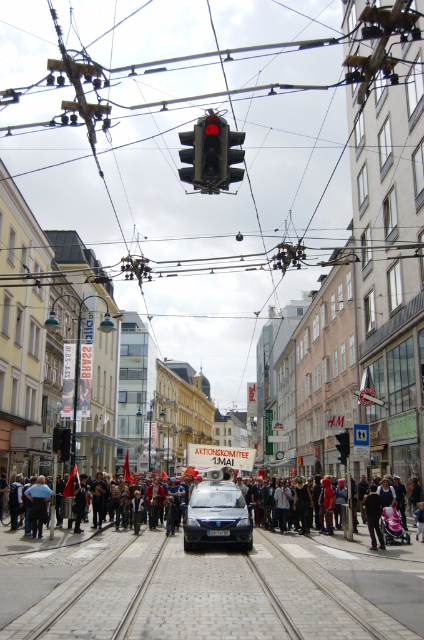
Does white matte van at center have a greater height compared to black plastic traffic light at upper center?

No, white matte van at center is not taller than black plastic traffic light at upper center.

Does white matte van at center have a larger size compared to black plastic traffic light at upper center?

No.

Where is `white matte van at center`? The image size is (424, 640). white matte van at center is located at coordinates (217, 515).

Find the location of `white matte van at center`. white matte van at center is located at coordinates (217, 515).

Is black fabric crowd at center further to camera compared to dark blue jeans at center?

That is False.

How much distance is there between black fabric crowd at center and dark blue jeans at center?

black fabric crowd at center and dark blue jeans at center are 4.00 meters apart.

Is point (58, 540) in front of point (36, 515)?

Yes, it is in front of point (36, 515).

Image resolution: width=424 pixels, height=640 pixels. Find the location of `black fabric crowd at center`. black fabric crowd at center is located at coordinates (39, 540).

Between black glass traffic light at upper center and black glass traffic light at center, which one appears on the right side from the viewer's perspective?

Positioned to the right is black glass traffic light at center.

Can you confirm if black glass traffic light at upper center is smaller than black glass traffic light at center?

Actually, black glass traffic light at upper center might be larger than black glass traffic light at center.

You are a GUI agent. You are given a task and a screenshot of the screen. Output one action in this format:
    pyautogui.click(x=<x>, y=<y>)
    Task: Click on the black glass traffic light at upper center
    This screenshot has height=640, width=424.
    Given the screenshot: What is the action you would take?
    pyautogui.click(x=211, y=154)